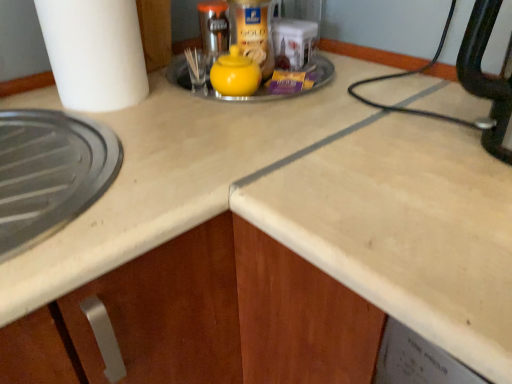
Question: Is yellow matte teapot at center wider or thinner than white matte paper towel at left?

Choices:
 (A) wide
 (B) thin

Answer: (B)

Question: From the image's perspective, is yellow matte teapot at center above or below white matte paper towel at left?

Choices:
 (A) below
 (B) above

Answer: (A)

Question: Which object is positioned farthest from the yellow matte sugar bowl at center?

Choices:
 (A) yellow matte teapot at center
 (B) white matte paper towel at left

Answer: (B)

Question: Estimate the real-world distances between objects in this image. Which object is farther from the yellow matte teapot at center?

Choices:
 (A) white matte paper towel at left
 (B) yellow matte sugar bowl at center

Answer: (A)